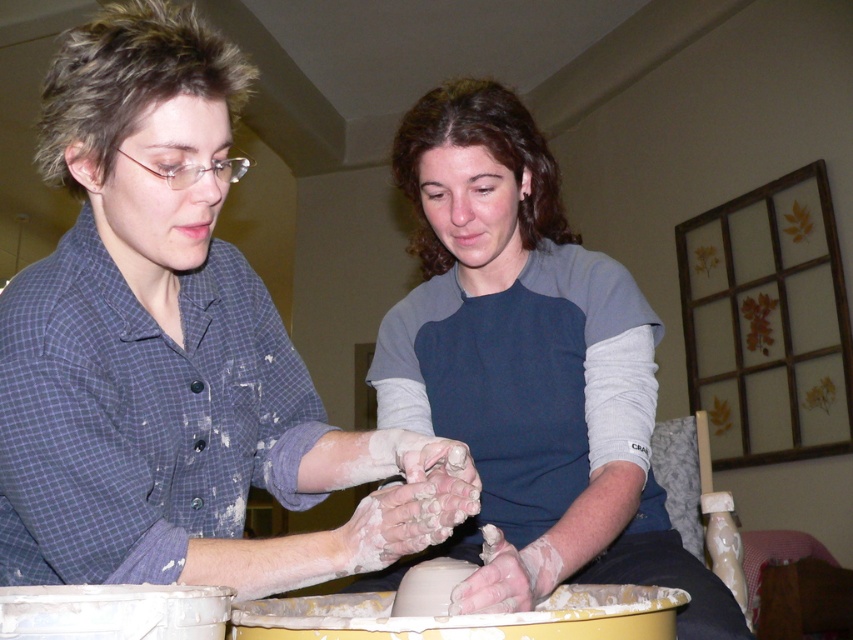
Question: Does matte gray shirt at center have a larger size compared to blue fabric shirt at center?

Choices:
 (A) no
 (B) yes

Answer: (A)

Question: Among these points, which one is farthest from the camera?

Choices:
 (A) coord(160,314)
 (B) coord(625,544)

Answer: (B)

Question: Which object is farther from the camera taking this photo?

Choices:
 (A) matte gray shirt at center
 (B) blue fabric shirt at center

Answer: (B)

Question: Does matte gray shirt at center come in front of blue fabric shirt at center?

Choices:
 (A) yes
 (B) no

Answer: (A)

Question: Is matte gray shirt at center positioned before blue fabric shirt at center?

Choices:
 (A) no
 (B) yes

Answer: (B)